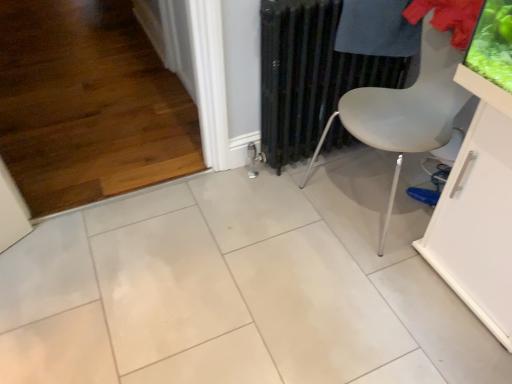
What are the coordinates of `free space to the left of white matte chair at center-right` in the screenshot? It's located at (284, 213).